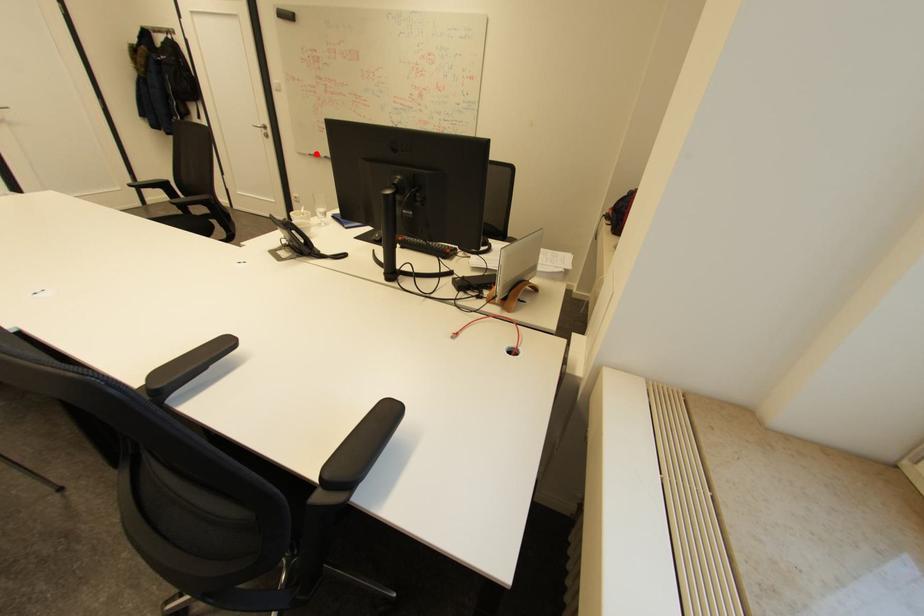
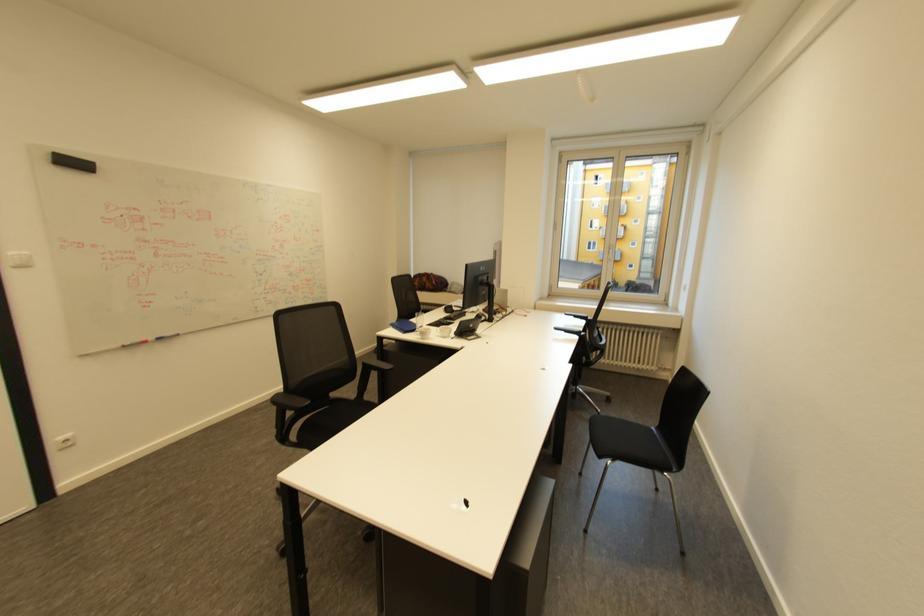
Locate, in the second image, the point that corresponds to the highlighted location in the first image.

(128, 346)